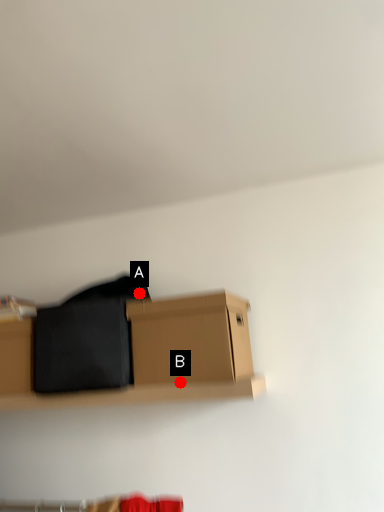
Question: Two points are circled on the image, labeled by A and B beside each circle. Which point is farther from the camera taking this photo?

Choices:
 (A) A is further
 (B) B is further

Answer: (A)